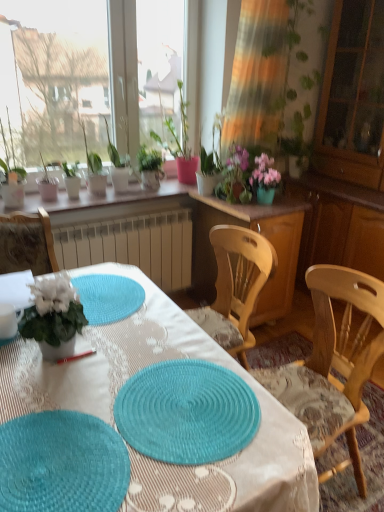
I want to click on free space behind teal woven mat at lower left, which is the 1th mat in left-to-right order, so tap(91, 379).